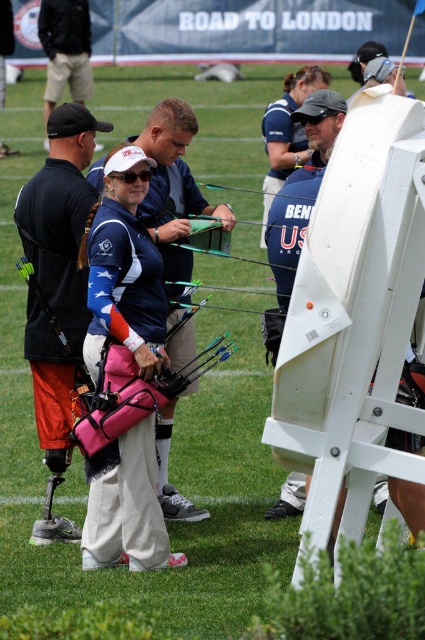
Between pink fabric bag at center and blue fabric shirt at center, which one appears on the right side from the viewer's perspective?

blue fabric shirt at center is more to the right.

Image resolution: width=425 pixels, height=640 pixels. What do you see at coordinates (57, 294) in the screenshot?
I see `pink fabric bag at center` at bounding box center [57, 294].

Locate an element on the screen. pink fabric bag at center is located at coordinates (57, 294).

Does pink fabric bag at center appear under pink fabric bow at center?

Indeed, pink fabric bag at center is positioned under pink fabric bow at center.

Is point (81, 336) positioned in front of point (172, 356)?

Yes.

Is point (51, 348) positioned before point (192, 177)?

Yes, point (51, 348) is in front of point (192, 177).

You are a GUI agent. You are given a task and a screenshot of the screen. Output one action in this format:
    pyautogui.click(x=<x>, y=<y>)
    Task: Click on the pink fabric bag at center
    
    Given the screenshot: What is the action you would take?
    pyautogui.click(x=57, y=294)

Consider the image. Can you confirm if pink fabric bow at center is shorter than blue fabric shirt at center?

In fact, pink fabric bow at center may be taller than blue fabric shirt at center.

Based on the photo, can you confirm if pink fabric bow at center is thinner than blue fabric shirt at center?

Incorrect, pink fabric bow at center's width is not less than blue fabric shirt at center's.

Where is `pink fabric bow at center`? The width and height of the screenshot is (425, 640). pink fabric bow at center is located at coordinates (172, 189).

This screenshot has width=425, height=640. Identify the location of pink fabric bow at center. (172, 189).